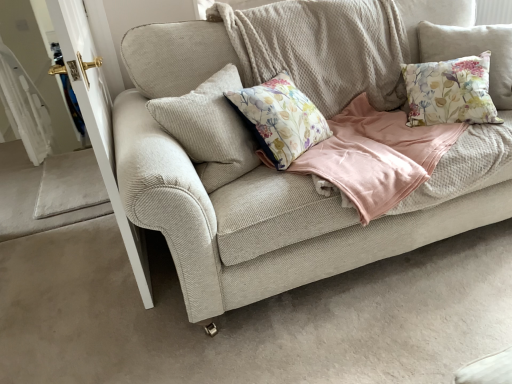
Identify the location of unoccupied area in front of white glossy door handle at left. The width and height of the screenshot is (512, 384). [126, 326].